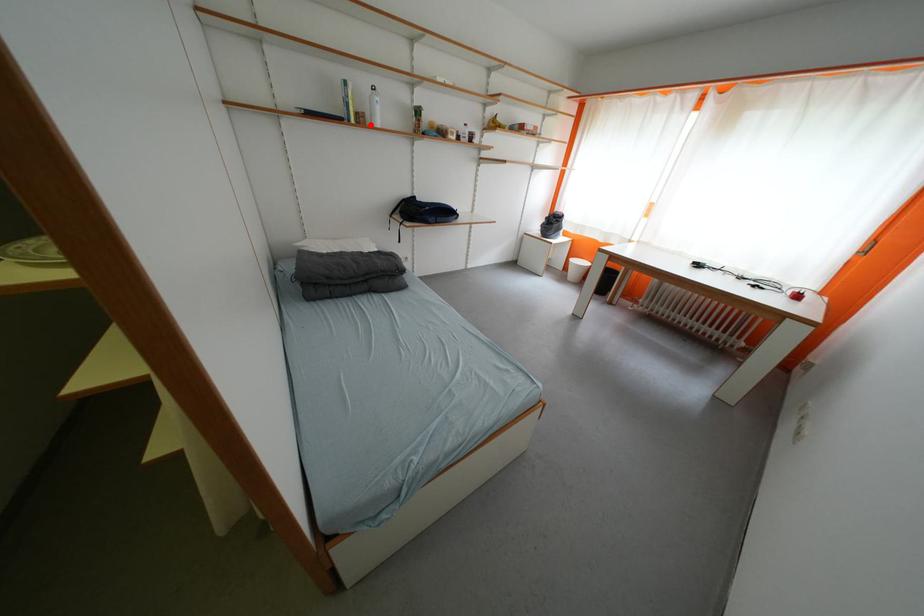
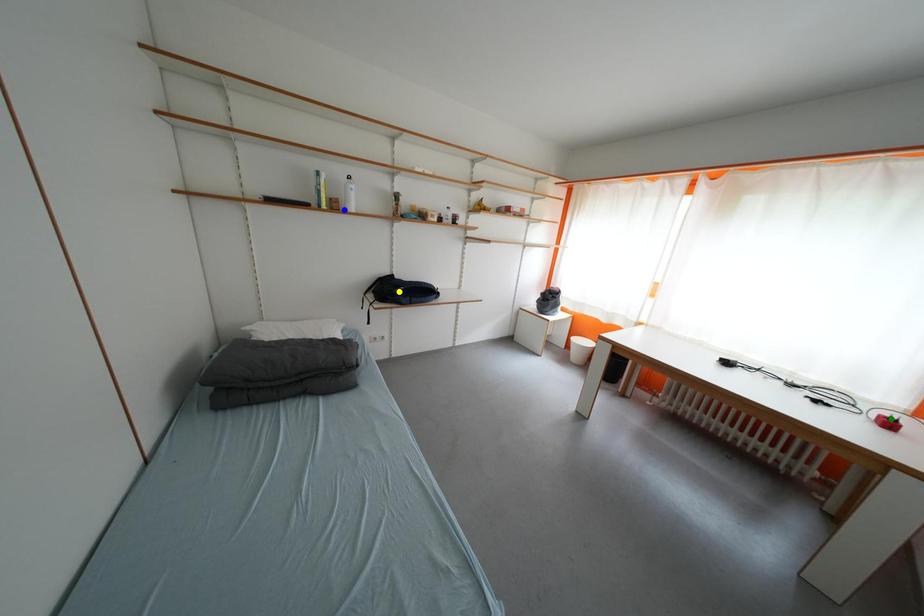
Question: I am providing you with two images of the same scene from different viewpoints. A red point is marked on the first image. You are given multiple points on the second image. Which mark in image 2 goes with the point in image 1?

Choices:
 (A) yellow point
 (B) blue point
 (C) green point

Answer: (B)